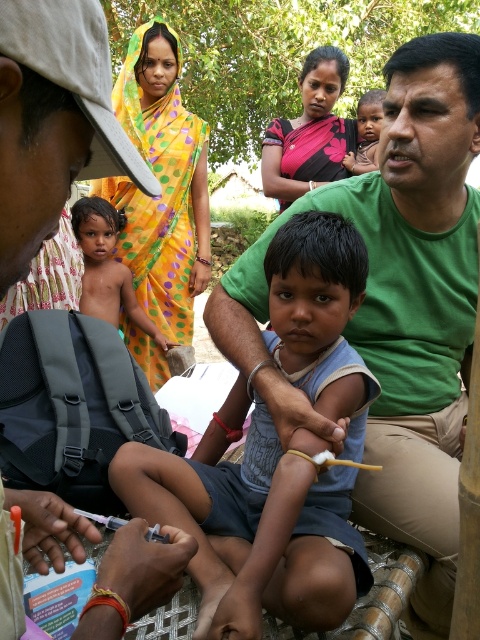
Image resolution: width=480 pixels, height=640 pixels. Identify the location of polka dot sari at center. (310, 132).

Between polka dot sari at center and matte skin child at center, which one has more height?

With more height is polka dot sari at center.

Between point (324, 156) and point (360, 97), which one is positioned in front?

Point (324, 156) is more forward.

Where is `polka dot sari at center`? polka dot sari at center is located at coordinates (310, 132).

The width and height of the screenshot is (480, 640). Describe the element at coordinates (162, 182) in the screenshot. I see `yellow dotted sari at upper left` at that location.

Between point (133, 116) and point (362, 160), which one is positioned in front?

Point (133, 116) is more forward.

The height and width of the screenshot is (640, 480). I want to click on yellow dotted sari at upper left, so click(162, 182).

Where is `yellow dotted sari at upper left`? Image resolution: width=480 pixels, height=640 pixels. yellow dotted sari at upper left is located at coordinates (162, 182).

Which is more to the left, green matte shirt at upper right or shiny skin child at center?

shiny skin child at center

Is green matte shirt at upper right thinner than shiny skin child at center?

Correct, green matte shirt at upper right's width is less than shiny skin child at center's.

Which is behind, point (35, 252) or point (90, 291)?

Positioned behind is point (90, 291).

Identify the location of green matte shirt at upper right. This screenshot has height=640, width=480. coord(51,120).